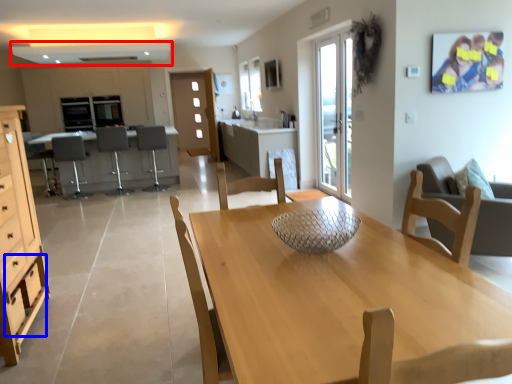
Question: Which of the following is the farthest to the observer, exhaust hood (highlighted by a red box) or drawer (highlighted by a blue box)?

Choices:
 (A) exhaust hood
 (B) drawer

Answer: (A)